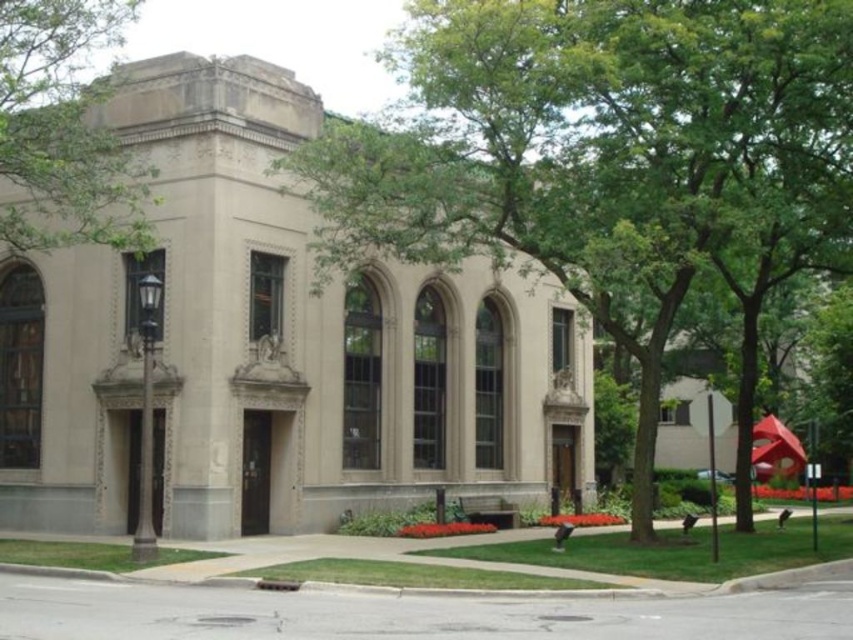
Question: Which of the following is the farthest from the observer?

Choices:
 (A) (643, 19)
 (B) (42, 92)

Answer: (B)

Question: Which of the following is the closest to the observer?

Choices:
 (A) (22, 196)
 (B) (447, 77)

Answer: (B)

Question: Among these objects, which one is farthest from the camera?

Choices:
 (A) green leafy tree at upper center
 (B) green leafy tree at center

Answer: (A)

Question: Is green leafy tree at center to the left of green leafy tree at upper center from the viewer's perspective?

Choices:
 (A) yes
 (B) no

Answer: (B)

Question: Can you confirm if green leafy tree at center is thinner than green leafy tree at upper center?

Choices:
 (A) yes
 (B) no

Answer: (B)

Question: Is green leafy tree at center further to camera compared to green leafy tree at upper center?

Choices:
 (A) no
 (B) yes

Answer: (A)